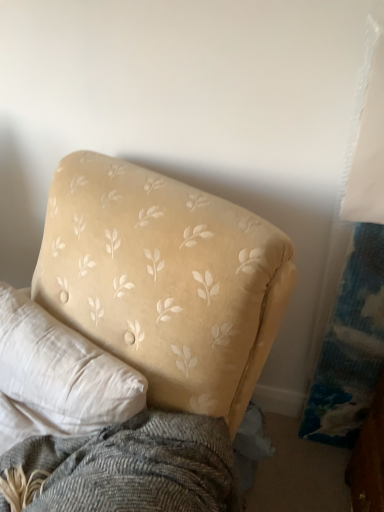
Question: Considering the positions of velvet yellow couch at upper left and beige fabric pillow at upper left in the image, is velvet yellow couch at upper left wider or thinner than beige fabric pillow at upper left?

Choices:
 (A) wide
 (B) thin

Answer: (A)

Question: Is velvet yellow couch at upper left taller or shorter than beige fabric pillow at upper left?

Choices:
 (A) tall
 (B) short

Answer: (A)

Question: From a real-world perspective, is velvet yellow couch at upper left physically located above or below beige fabric pillow at upper left?

Choices:
 (A) below
 (B) above

Answer: (A)

Question: From the image's perspective, is beige fabric pillow at upper left located above or below velvet yellow couch at upper left?

Choices:
 (A) below
 (B) above

Answer: (B)

Question: Is beige fabric pillow at upper left inside or outside of velvet yellow couch at upper left?

Choices:
 (A) inside
 (B) outside

Answer: (A)

Question: Is beige fabric pillow at upper left taller or shorter than velvet yellow couch at upper left?

Choices:
 (A) short
 (B) tall

Answer: (A)

Question: Looking at their shapes, would you say beige fabric pillow at upper left is wider or thinner than velvet yellow couch at upper left?

Choices:
 (A) thin
 (B) wide

Answer: (A)